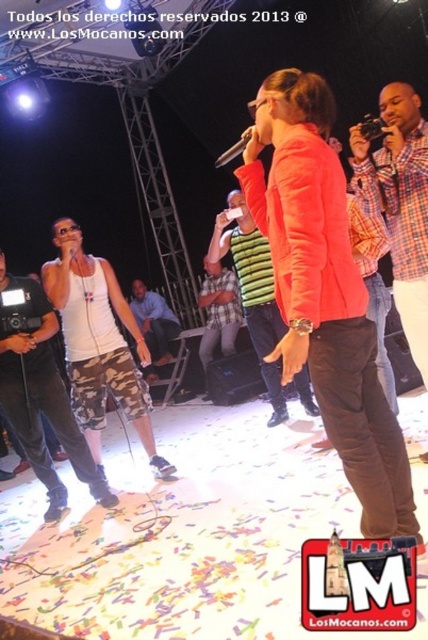
Question: Which of the following is the closest to the observer?

Choices:
 (A) (219, 292)
 (B) (404, 333)
 (C) (168, 356)
 (D) (166, 470)

Answer: (B)

Question: In this image, where is white matte tank top at left located relative to green striped shirt at center?

Choices:
 (A) below
 (B) above

Answer: (A)

Question: Can you confirm if white camo pants at left is smaller than orange fabric jacket at center?

Choices:
 (A) no
 (B) yes

Answer: (B)

Question: Does white matte tank top at left come behind metallic silver microphone at center?

Choices:
 (A) no
 (B) yes

Answer: (B)

Question: Which object is farther from the camera taking this photo?

Choices:
 (A) metallic silver microphone at center
 (B) plaid shirt at upper right
 (C) orange fabric jacket at center
 (D) white camo pants at left

Answer: (C)

Question: Which of the following is the farthest from the observer?

Choices:
 (A) (374, 136)
 (B) (264, 243)
 (C) (214, 301)

Answer: (C)